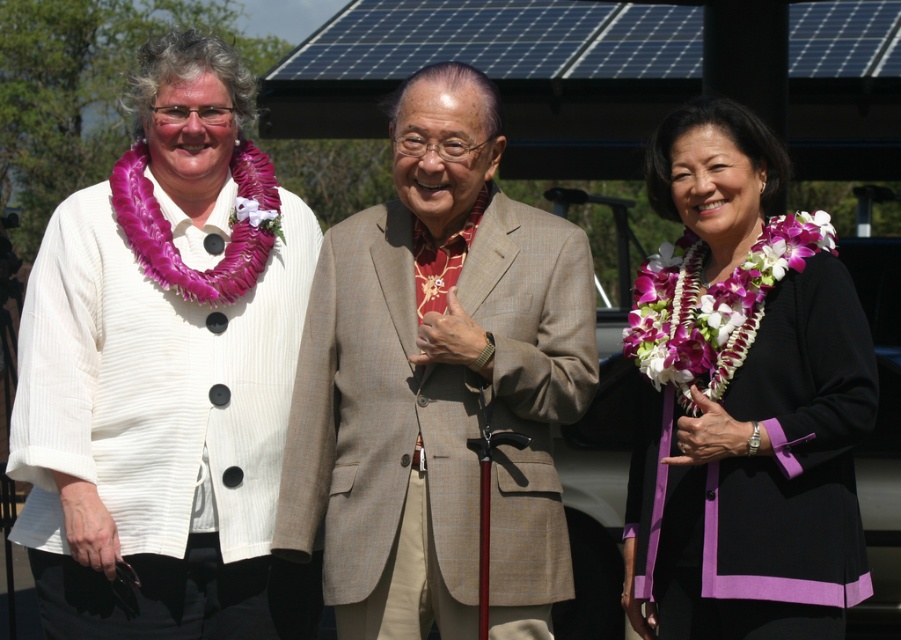
Who is positioned more to the right, white textured cardigan at left or black satin blazer at center?

black satin blazer at center

Is white textured cardigan at left below black satin blazer at center?

No, white textured cardigan at left is not below black satin blazer at center.

Which is in front, point (205, 113) or point (826, 435)?

Point (826, 435)

The height and width of the screenshot is (640, 901). Identify the location of white textured cardigan at left. (166, 372).

Is the position of white textured cardigan at left more distant than that of tan textured suit at center?

Yes, it is behind tan textured suit at center.

Between white textured cardigan at left and tan textured suit at center, which one is positioned lower?

tan textured suit at center is lower down.

Between point (148, 435) and point (454, 529), which one is positioned behind?

Positioned behind is point (148, 435).

Locate an element on the screen. Image resolution: width=901 pixels, height=640 pixels. white textured cardigan at left is located at coordinates (166, 372).

Can you confirm if tan textured suit at center is positioned to the right of black satin blazer at center?

In fact, tan textured suit at center is to the left of black satin blazer at center.

What do you see at coordinates (437, 385) in the screenshot? Image resolution: width=901 pixels, height=640 pixels. I see `tan textured suit at center` at bounding box center [437, 385].

In order to click on tan textured suit at center in this screenshot , I will do `click(437, 385)`.